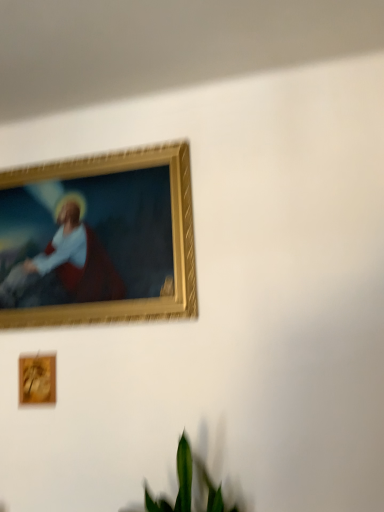
Question: Can we say wooden frame at lower left, which is counted as the first picture frame, starting from the bottom, lies outside gold-framed painting at upper left, arranged as the 2th picture frame when ordered from the bottom?

Choices:
 (A) yes
 (B) no

Answer: (A)

Question: Does wooden frame at lower left, which is counted as the first picture frame, starting from the bottom, have a greater height compared to gold-framed painting at upper left, the first picture frame from the top?

Choices:
 (A) no
 (B) yes

Answer: (A)

Question: Can you confirm if wooden frame at lower left, the 2th picture frame positioned from the top, is shorter than gold-framed painting at upper left, arranged as the 2th picture frame when ordered from the bottom?

Choices:
 (A) yes
 (B) no

Answer: (A)

Question: Is wooden frame at lower left, the 2th picture frame positioned from the top, beside gold-framed painting at upper left, arranged as the 2th picture frame when ordered from the bottom?

Choices:
 (A) no
 (B) yes

Answer: (A)

Question: Can you confirm if wooden frame at lower left, the 2th picture frame positioned from the top, is thinner than gold-framed painting at upper left, the first picture frame from the top?

Choices:
 (A) yes
 (B) no

Answer: (A)

Question: Considering the positions of gold-framed painting at upper left, arranged as the 2th picture frame when ordered from the bottom, and green leafy plant at lower center in the image, is gold-framed painting at upper left, arranged as the 2th picture frame when ordered from the bottom, taller or shorter than green leafy plant at lower center?

Choices:
 (A) tall
 (B) short

Answer: (A)

Question: Relative to green leafy plant at lower center, is gold-framed painting at upper left, arranged as the 2th picture frame when ordered from the bottom, in front or behind?

Choices:
 (A) front
 (B) behind

Answer: (B)

Question: From the image's perspective, is gold-framed painting at upper left, arranged as the 2th picture frame when ordered from the bottom, positioned above or below green leafy plant at lower center?

Choices:
 (A) above
 (B) below

Answer: (A)

Question: Looking at their shapes, would you say gold-framed painting at upper left, arranged as the 2th picture frame when ordered from the bottom, is wider or thinner than green leafy plant at lower center?

Choices:
 (A) thin
 (B) wide

Answer: (A)

Question: Is green leafy plant at lower center wider or thinner than gold-framed painting at upper left, arranged as the 2th picture frame when ordered from the bottom?

Choices:
 (A) wide
 (B) thin

Answer: (A)

Question: Considering the relative positions of green leafy plant at lower center and gold-framed painting at upper left, arranged as the 2th picture frame when ordered from the bottom, in the image provided, is green leafy plant at lower center to the left or to the right of gold-framed painting at upper left, arranged as the 2th picture frame when ordered from the bottom,?

Choices:
 (A) right
 (B) left

Answer: (A)

Question: Considering the positions of point (158, 506) and point (49, 219), is point (158, 506) closer or farther from the camera than point (49, 219)?

Choices:
 (A) closer
 (B) farther

Answer: (A)

Question: Considering the positions of green leafy plant at lower center and gold-framed painting at upper left, arranged as the 2th picture frame when ordered from the bottom, in the image, is green leafy plant at lower center taller or shorter than gold-framed painting at upper left, arranged as the 2th picture frame when ordered from the bottom,?

Choices:
 (A) short
 (B) tall

Answer: (A)

Question: From the image's perspective, is green leafy plant at lower center located above or below wooden frame at lower left, the 2th picture frame positioned from the top?

Choices:
 (A) below
 (B) above

Answer: (A)

Question: From a real-world perspective, relative to wooden frame at lower left, which is counted as the first picture frame, starting from the bottom, is green leafy plant at lower center vertically above or below?

Choices:
 (A) below
 (B) above

Answer: (A)